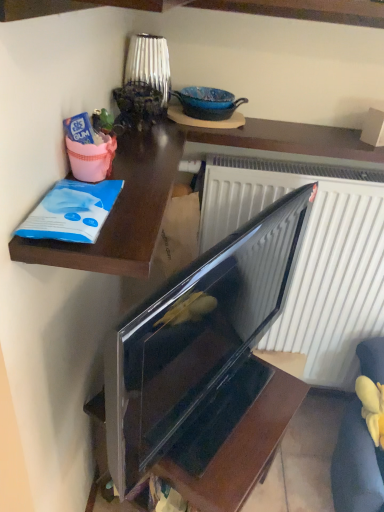
Question: From the image's perspective, is velvet yellow armchair at lower right under glossy black tv at lower right?

Choices:
 (A) yes
 (B) no

Answer: (A)

Question: Does velvet yellow armchair at lower right appear on the left side of glossy black tv at lower right?

Choices:
 (A) yes
 (B) no

Answer: (B)

Question: Does velvet yellow armchair at lower right turn towards glossy black tv at lower right?

Choices:
 (A) yes
 (B) no

Answer: (B)

Question: From a real-world perspective, is velvet yellow armchair at lower right on glossy black tv at lower right?

Choices:
 (A) no
 (B) yes

Answer: (B)

Question: Is velvet yellow armchair at lower right positioned behind glossy black tv at lower right?

Choices:
 (A) yes
 (B) no

Answer: (A)

Question: Is glossy black tv at center taller or shorter than glossy black tv at lower right?

Choices:
 (A) tall
 (B) short

Answer: (A)

Question: Is glossy black tv at center in front of or behind glossy black tv at lower right in the image?

Choices:
 (A) front
 (B) behind

Answer: (A)

Question: Choose the correct answer: Is glossy black tv at center inside glossy black tv at lower right or outside it?

Choices:
 (A) inside
 (B) outside

Answer: (B)

Question: From the image's perspective, is glossy black tv at center positioned above or below glossy black tv at lower right?

Choices:
 (A) below
 (B) above

Answer: (B)

Question: From the image's perspective, is velvet yellow armchair at lower right above or below glossy black tv at center?

Choices:
 (A) below
 (B) above

Answer: (A)

Question: In terms of width, does velvet yellow armchair at lower right look wider or thinner when compared to glossy black tv at center?

Choices:
 (A) thin
 (B) wide

Answer: (B)

Question: From their relative heights in the image, would you say velvet yellow armchair at lower right is taller or shorter than glossy black tv at center?

Choices:
 (A) short
 (B) tall

Answer: (A)

Question: Is velvet yellow armchair at lower right spatially inside glossy black tv at center, or outside of it?

Choices:
 (A) inside
 (B) outside

Answer: (B)

Question: From a real-world perspective, is shiny blue ceramic bowl at upper center physically located above or below glossy black tv at center?

Choices:
 (A) below
 (B) above

Answer: (B)

Question: Considering the positions of shiny blue ceramic bowl at upper center and glossy black tv at center in the image, is shiny blue ceramic bowl at upper center wider or thinner than glossy black tv at center?

Choices:
 (A) thin
 (B) wide

Answer: (B)